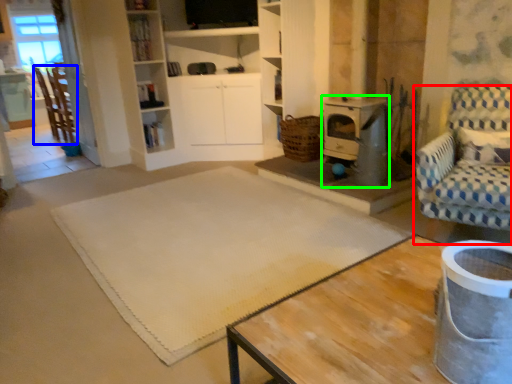
Question: Which is nearer to the chair (highlighted by a red box)? chair (highlighted by a blue box) or appliance (highlighted by a green box).

Choices:
 (A) chair
 (B) appliance

Answer: (B)